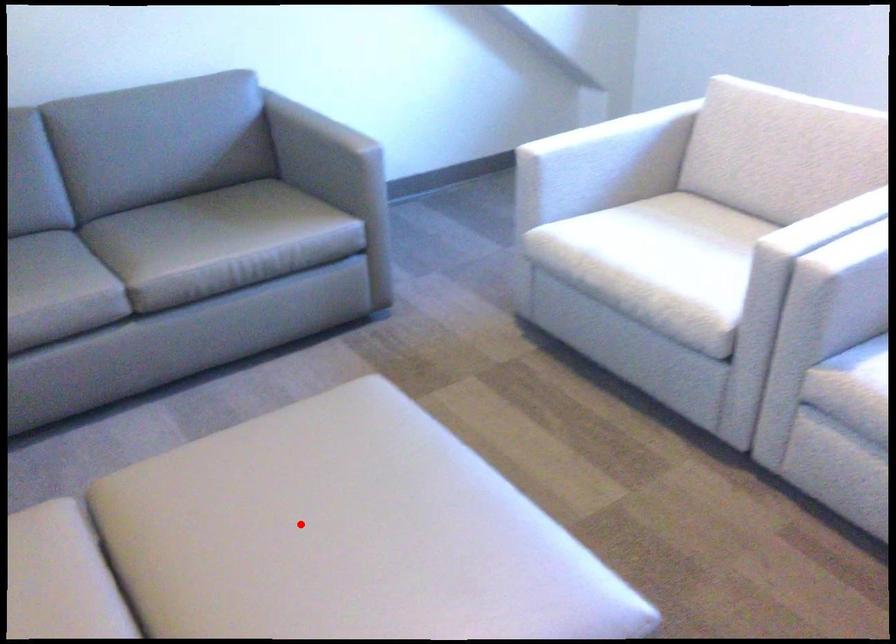
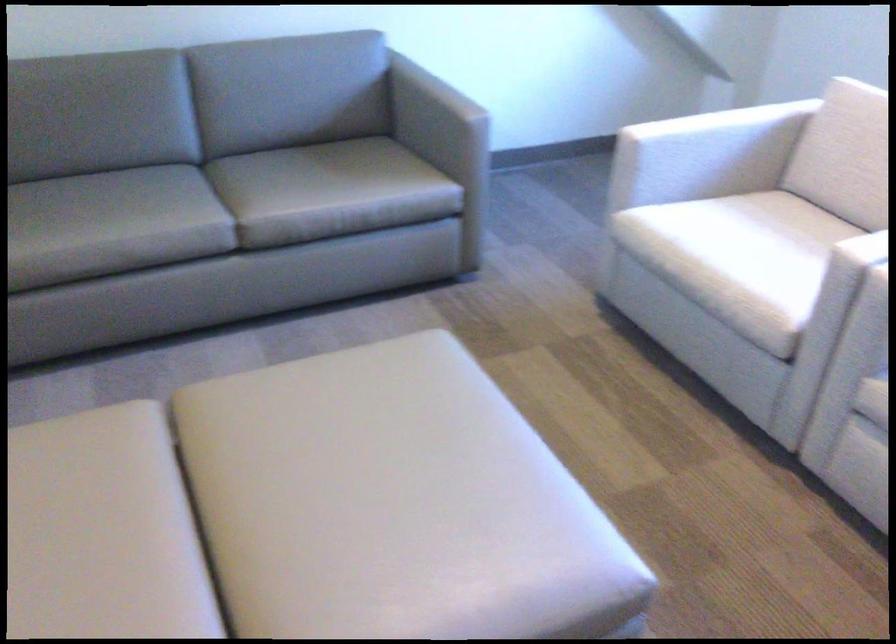
Where in the second image is the point corresponding to the highlighted location from the first image?

(348, 446)